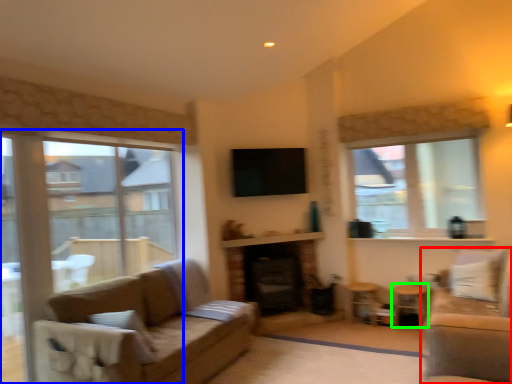
Question: Which object is positioned farthest from studio couch (highlighted by a red box)? Select from window (highlighted by a blue box) and side table (highlighted by a green box).

Choices:
 (A) window
 (B) side table

Answer: (A)